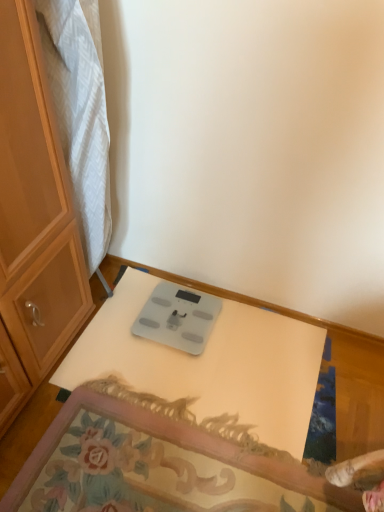
Where is `silver metallic scale at center`? This screenshot has width=384, height=512. silver metallic scale at center is located at coordinates (178, 318).

Image resolution: width=384 pixels, height=512 pixels. I want to click on white glossy table at center, so (354, 387).

This screenshot has height=512, width=384. What are the coordinates of `matte wood cabinet at left` in the screenshot? It's located at (33, 221).

Based on the photo, from a real-world perspective, which object stands above the other?

From a 3D spatial view, matte wood cabinet at left is above.

Is matte wood cabinet at left shorter than silver metallic scale at center?

No, matte wood cabinet at left is not shorter than silver metallic scale at center.

Considering the positions of objects matte wood cabinet at left and silver metallic scale at center in the image provided, who is more to the right, matte wood cabinet at left or silver metallic scale at center?

silver metallic scale at center.

Considering the points (143, 309) and (12, 103), which point is behind, point (143, 309) or point (12, 103)?

Point (143, 309)

Based on the photo, between silver metallic scale at center and matte wood cabinet at left, which one is positioned behind?

silver metallic scale at center is more distant.

In terms of width, does silver metallic scale at center look wider or thinner when compared to matte wood cabinet at left?

Clearly, silver metallic scale at center has less width compared to matte wood cabinet at left.

Is silver metallic scale at center outside of matte wood cabinet at left?

Yes, silver metallic scale at center is outside of matte wood cabinet at left.

Is white glossy table at center closer to the viewer compared to silver metallic scale at center?

Yes, the depth of white glossy table at center is less than that of silver metallic scale at center.

Does white glossy table at center have a smaller size compared to silver metallic scale at center?

No.

Based on the photo, from a real-world perspective, which object rests below the other?

silver metallic scale at center, from a real-world perspective.

Considering the relative sizes of white glossy table at center and silver metallic scale at center in the image provided, is white glossy table at center thinner than silver metallic scale at center?

In fact, white glossy table at center might be wider than silver metallic scale at center.

Considering the sizes of matte wood cabinet at left and white glossy table at center in the image, is matte wood cabinet at left taller or shorter than white glossy table at center?

matte wood cabinet at left is taller than white glossy table at center.

Is matte wood cabinet at left surrounding white glossy table at center?

That's incorrect, white glossy table at center is not inside matte wood cabinet at left.

Based on the photo, between matte wood cabinet at left and white glossy table at center, which one has smaller size?

white glossy table at center.

Visually, is matte wood cabinet at left positioned to the left or to the right of white glossy table at center?

matte wood cabinet at left is positioned on white glossy table at center's left side.

Is silver metallic scale at center facing away from white glossy table at center?

Yes, silver metallic scale at center is positioned with its back facing white glossy table at center.

From a real-world perspective, relative to white glossy table at center, is silver metallic scale at center vertically above or below?

In terms of real-world spatial position, silver metallic scale at center is below white glossy table at center.

Consider the image. Is silver metallic scale at center taller or shorter than white glossy table at center?

In the image, silver metallic scale at center appears to be shorter than white glossy table at center.

Does white glossy table at center turn towards matte wood cabinet at left?

No, white glossy table at center is not aimed at matte wood cabinet at left.

Considering the positions of objects white glossy table at center and matte wood cabinet at left in the image provided, who is more to the right, white glossy table at center or matte wood cabinet at left?

white glossy table at center.

From the image's perspective, is white glossy table at center positioned above or below matte wood cabinet at left?

white glossy table at center is below matte wood cabinet at left.

Is white glossy table at center outside of matte wood cabinet at left?

white glossy table at center is positioned outside matte wood cabinet at left.

The width and height of the screenshot is (384, 512). I want to click on weight scale behind the matte wood cabinet at left, so click(178, 318).

The height and width of the screenshot is (512, 384). In order to click on cabinetry above the silver metallic scale at center (from a real-world perspective) in this screenshot , I will do `click(33, 221)`.

Looking at the image, which one is located further to matte wood cabinet at left, white glossy table at center or silver metallic scale at center?

white glossy table at center.

From the image, which object appears to be farther from silver metallic scale at center, white glossy table at center or matte wood cabinet at left?

Based on the image, matte wood cabinet at left appears to be further to silver metallic scale at center.

Looking at the image, which one is located further to white glossy table at center, matte wood cabinet at left or silver metallic scale at center?

matte wood cabinet at left lies further to white glossy table at center than the other object.

Looking at the image, which one is located further to white glossy table at center, silver metallic scale at center or matte wood cabinet at left?

Based on the image, matte wood cabinet at left appears to be further to white glossy table at center.

Estimate the real-world distances between objects in this image. Which object is closer to silver metallic scale at center, matte wood cabinet at left or white glossy table at center?

Based on the image, white glossy table at center appears to be nearer to silver metallic scale at center.

Based on their spatial positions, is silver metallic scale at center or white glossy table at center further from matte wood cabinet at left?

white glossy table at center.

Identify the location of weight scale between matte wood cabinet at left and white glossy table at center vertically. The width and height of the screenshot is (384, 512). (178, 318).